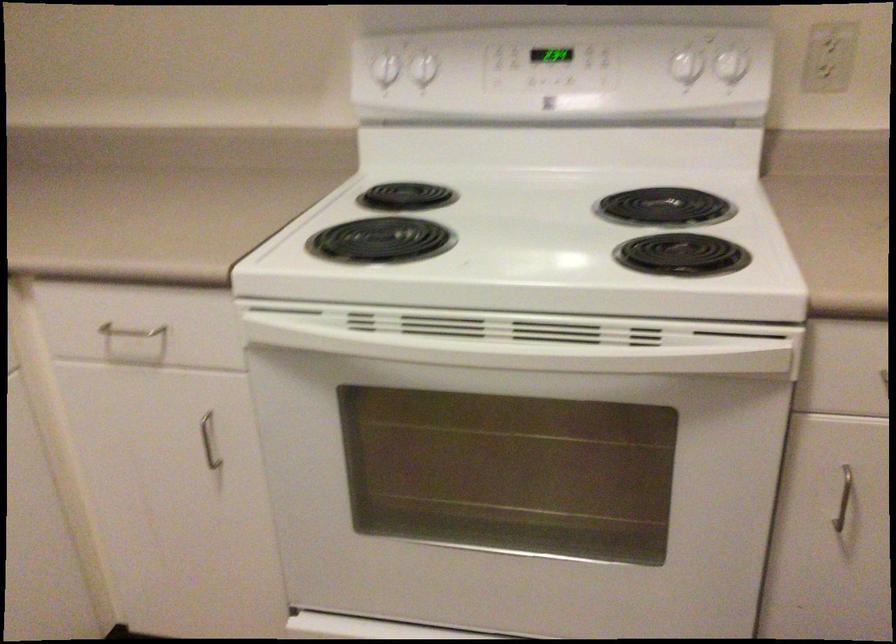
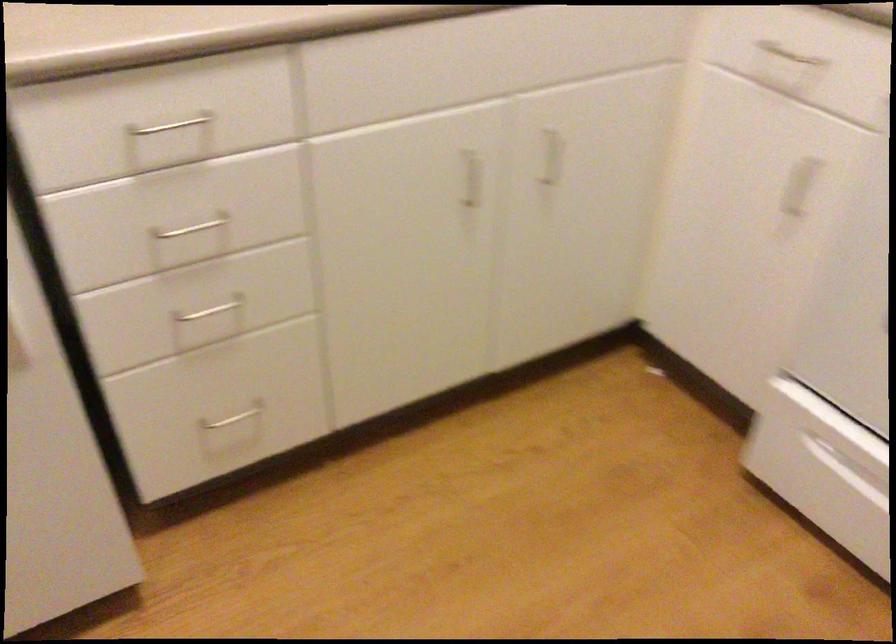
In the second image, find the point that corresponds to (x=138, y=328) in the first image.

(789, 55)